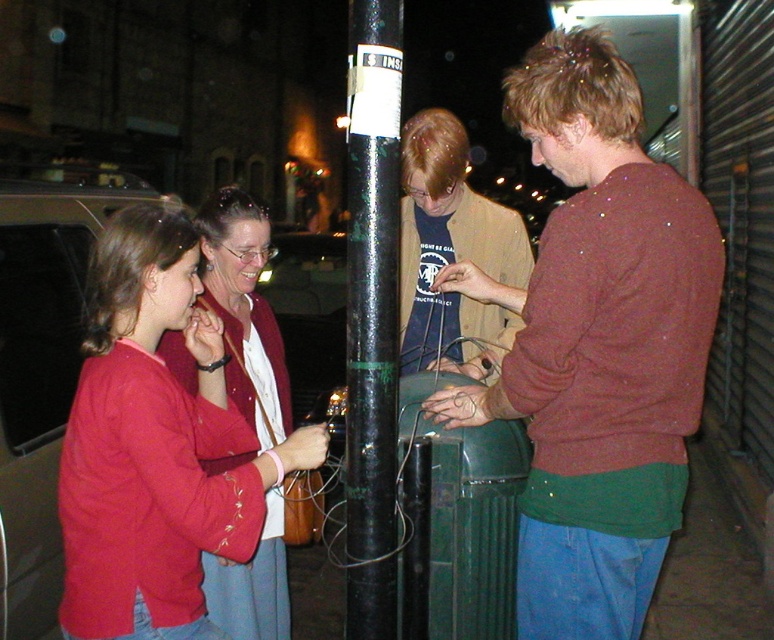
You are standing at the point marked by the coordinate point at point (605, 44). You need to reach a tool located 2 meters away from your current position. Can you safely retrieve it without moving more than 2 meters?

Yes, since the distance between you and the tool is exactly 2 meters, you can safely retrieve it without moving more than 2 meters.

You are a passerby who wants to take a photo of the black glossy pole at center without any people blocking it. Considering the size of the maroon sweater at center, is there enough space to move around to get an unobstructed view?

The maroon sweater at center has a larger size compared to black glossy pole at center, so there might not be enough space to move around to get an unobstructed view without the person in the maroon sweater blocking it.

You are a pedestrian trying to cross the street at night and see the black glossy pole at center and the matte red sweater at left. Which object takes up more visual space in the image?

The matte red sweater at left occupies more visual space than the black glossy pole at center according to the description.